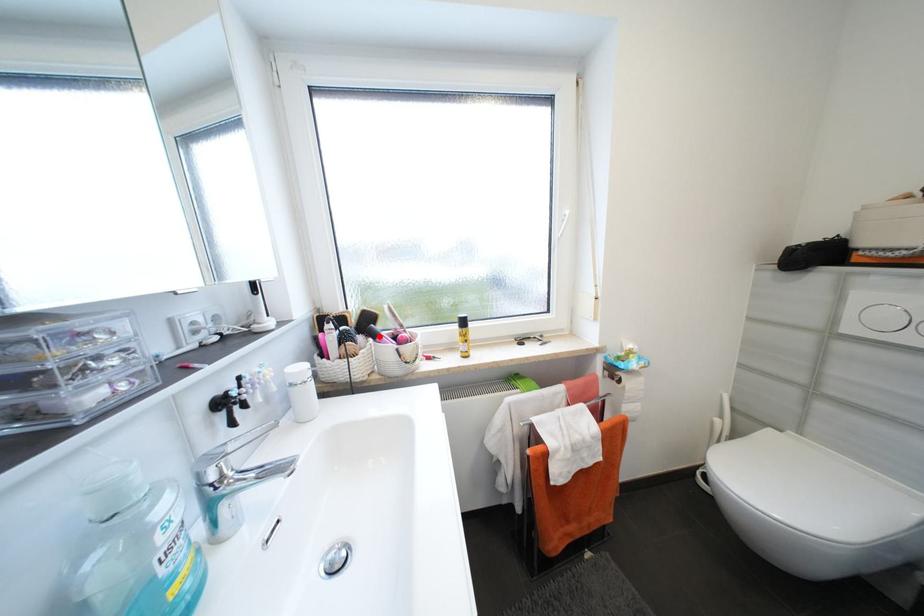
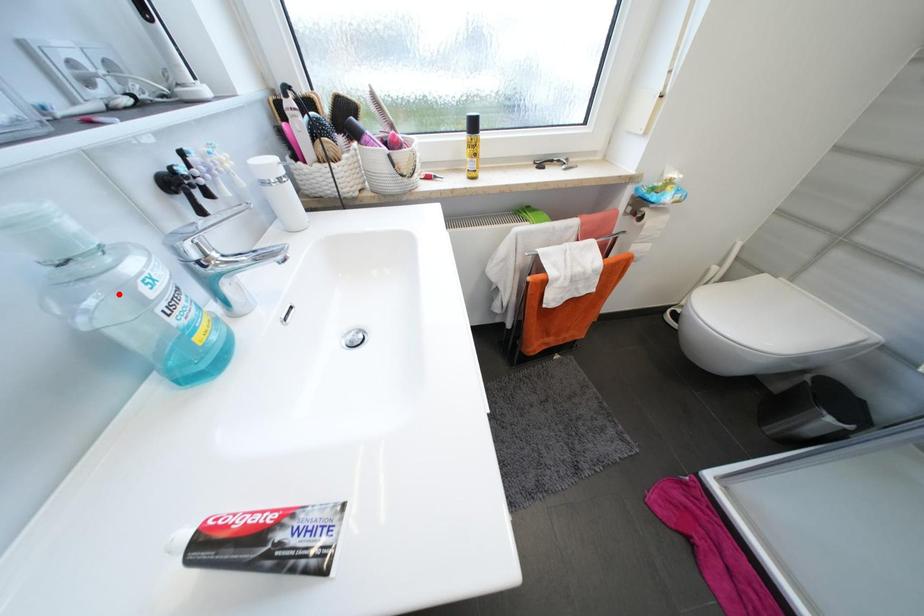
I am providing you with two images of the same scene from different viewpoints. A red point is marked on the first image and another point is marked on the second image. Do the highlighted points in image1 and image2 indicate the same real-world spot?

No